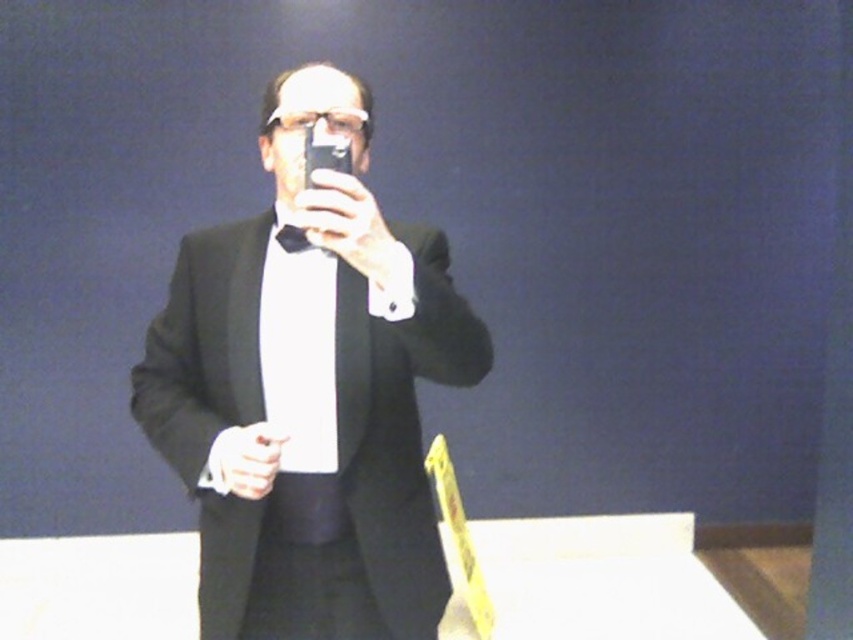
Question: Can you confirm if black matte suit at center is positioned to the left of black satin bow tie at center?

Choices:
 (A) yes
 (B) no

Answer: (B)

Question: Among these objects, which one is farthest from the camera?

Choices:
 (A) black satin bow tie at center
 (B) black matte suit at center

Answer: (A)

Question: Is black matte suit at center bigger than black satin bow tie at center?

Choices:
 (A) yes
 (B) no

Answer: (A)

Question: Is black matte suit at center positioned before black satin bow tie at center?

Choices:
 (A) yes
 (B) no

Answer: (A)